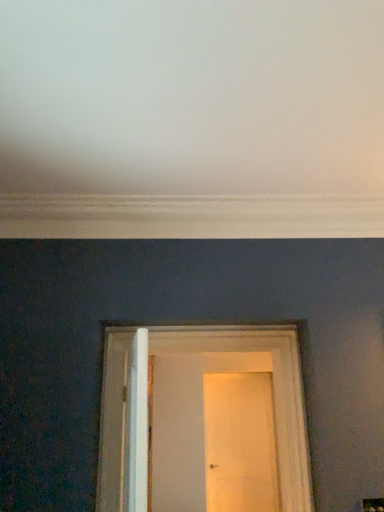
This screenshot has width=384, height=512. What do you see at coordinates (213, 367) in the screenshot?
I see `white wooden door at center, placed as the 1th door when sorted from front to back` at bounding box center [213, 367].

Where is `white wooden door at center, acting as the first door starting from the top`? white wooden door at center, acting as the first door starting from the top is located at coordinates (213, 367).

Based on the photo, measure the distance between white wooden door at center, marked as the second door in a bottom-to-top arrangement, and camera.

The depth of white wooden door at center, marked as the second door in a bottom-to-top arrangement, is 1.41 meters.

The width and height of the screenshot is (384, 512). Describe the element at coordinates (240, 443) in the screenshot. I see `wooden door at center, which is the second door in top-to-bottom order` at that location.

You are a GUI agent. You are given a task and a screenshot of the screen. Output one action in this format:
    pyautogui.click(x=<x>, y=<y>)
    Task: Click on the wooden door at center, the second door in the front-to-back sequence
    The image size is (384, 512).
    Given the screenshot: What is the action you would take?
    [x=240, y=443]

Measure the distance between point (261, 481) and camera.

The distance of point (261, 481) from camera is 5.39 meters.

Image resolution: width=384 pixels, height=512 pixels. I want to click on white wooden door at center, marked as the second door in a back-to-front arrangement, so click(x=213, y=367).

Between wooden door at center, which is the second door in top-to-bottom order, and white wooden door at center, acting as the first door starting from the top, which one appears on the left side from the viewer's perspective?

Positioned to the left is white wooden door at center, acting as the first door starting from the top.

In the image, is wooden door at center, the second door in the front-to-back sequence, positioned in front of or behind white wooden door at center, marked as the second door in a back-to-front arrangement?

Visually, wooden door at center, the second door in the front-to-back sequence, is located behind white wooden door at center, marked as the second door in a back-to-front arrangement.

Does point (249, 403) appear closer or farther from the camera than point (114, 478)?

Point (249, 403).

From the image's perspective, is wooden door at center, the second door in the front-to-back sequence, above or below white wooden door at center, acting as the first door starting from the top?

wooden door at center, the second door in the front-to-back sequence, is below white wooden door at center, acting as the first door starting from the top.

From a real-world perspective, is wooden door at center, arranged as the first door when ordered from the bottom, on white wooden door at center, placed as the 1th door when sorted from front to back?

No, from a real-world perspective, wooden door at center, arranged as the first door when ordered from the bottom, is not above white wooden door at center, placed as the 1th door when sorted from front to back.

Between wooden door at center, placed as the 1th door when sorted from back to front, and white wooden door at center, acting as the first door starting from the top, which one has larger width?

Wider between the two is white wooden door at center, acting as the first door starting from the top.

Considering the relative sizes of wooden door at center, arranged as the first door when ordered from the bottom, and white wooden door at center, marked as the second door in a bottom-to-top arrangement, in the image provided, is wooden door at center, arranged as the first door when ordered from the bottom, shorter than white wooden door at center, marked as the second door in a bottom-to-top arrangement,?

No.

Can you confirm if wooden door at center, which is the second door in top-to-bottom order, is bigger than white wooden door at center, placed as the 1th door when sorted from front to back?

No.

Is white wooden door at center, placed as the 1th door when sorted from front to back, inside wooden door at center, placed as the 1th door when sorted from back to front?

No, white wooden door at center, placed as the 1th door when sorted from front to back, is not surrounded by wooden door at center, placed as the 1th door when sorted from back to front.

Are wooden door at center, which is the second door in top-to-bottom order, and white wooden door at center, marked as the second door in a bottom-to-top arrangement, far apart?

Yes, wooden door at center, which is the second door in top-to-bottom order, is far from white wooden door at center, marked as the second door in a bottom-to-top arrangement.

Could you tell me if wooden door at center, arranged as the first door when ordered from the bottom, is facing white wooden door at center, marked as the second door in a back-to-front arrangement?

Yes, wooden door at center, arranged as the first door when ordered from the bottom, is aimed at white wooden door at center, marked as the second door in a back-to-front arrangement.

Where is `door lying behind the white wooden door at center, marked as the second door in a back-to-front arrangement`? The width and height of the screenshot is (384, 512). door lying behind the white wooden door at center, marked as the second door in a back-to-front arrangement is located at coordinates (240, 443).

Considering the relative positions of white wooden door at center, placed as the 1th door when sorted from front to back, and wooden door at center, the second door in the front-to-back sequence, in the image provided, is white wooden door at center, placed as the 1th door when sorted from front to back, to the left of wooden door at center, the second door in the front-to-back sequence, from the viewer's perspective?

Indeed, white wooden door at center, placed as the 1th door when sorted from front to back, is positioned on the left side of wooden door at center, the second door in the front-to-back sequence.

Between white wooden door at center, marked as the second door in a bottom-to-top arrangement, and wooden door at center, arranged as the first door when ordered from the bottom, which one is positioned in front?

white wooden door at center, marked as the second door in a bottom-to-top arrangement.

Which is closer to the camera, (285, 358) or (273, 443)?

Point (285, 358) appears to be closer to the viewer than point (273, 443).

From the image's perspective, between white wooden door at center, marked as the second door in a bottom-to-top arrangement, and wooden door at center, which is the second door in top-to-bottom order, which one is located above?

white wooden door at center, marked as the second door in a bottom-to-top arrangement.

From a real-world perspective, who is located lower, white wooden door at center, placed as the 1th door when sorted from front to back, or wooden door at center, the second door in the front-to-back sequence?

From a 3D spatial view, wooden door at center, the second door in the front-to-back sequence, is below.

From the picture: Considering the relative sizes of white wooden door at center, marked as the second door in a bottom-to-top arrangement, and wooden door at center, the second door in the front-to-back sequence, in the image provided, is white wooden door at center, marked as the second door in a bottom-to-top arrangement, thinner than wooden door at center, the second door in the front-to-back sequence,?

Incorrect, the width of white wooden door at center, marked as the second door in a bottom-to-top arrangement, is not less than that of wooden door at center, the second door in the front-to-back sequence.

In terms of height, does white wooden door at center, acting as the first door starting from the top, look taller or shorter compared to wooden door at center, arranged as the first door when ordered from the bottom?

white wooden door at center, acting as the first door starting from the top, is shorter than wooden door at center, arranged as the first door when ordered from the bottom.

Is white wooden door at center, marked as the second door in a back-to-front arrangement, bigger than wooden door at center, which is the second door in top-to-bottom order?

Correct, white wooden door at center, marked as the second door in a back-to-front arrangement, is larger in size than wooden door at center, which is the second door in top-to-bottom order.

Is white wooden door at center, placed as the 1th door when sorted from front to back, inside the boundaries of wooden door at center, placed as the 1th door when sorted from back to front, or outside?

white wooden door at center, placed as the 1th door when sorted from front to back, cannot be found inside wooden door at center, placed as the 1th door when sorted from back to front.

Consider the image. Is white wooden door at center, acting as the first door starting from the top, in contact with wooden door at center, the second door in the front-to-back sequence?

white wooden door at center, acting as the first door starting from the top, and wooden door at center, the second door in the front-to-back sequence, are not in contact.

Is wooden door at center, the second door in the front-to-back sequence, at the back of white wooden door at center, marked as the second door in a bottom-to-top arrangement?

Yes.

Locate an element on the screen. door below the white wooden door at center, marked as the second door in a back-to-front arrangement (from a real-world perspective) is located at coordinates (240, 443).

Image resolution: width=384 pixels, height=512 pixels. In order to click on door located on the right of white wooden door at center, placed as the 1th door when sorted from front to back in this screenshot , I will do `click(240, 443)`.

The height and width of the screenshot is (512, 384). In order to click on door above the wooden door at center, arranged as the first door when ordered from the bottom (from a real-world perspective) in this screenshot , I will do `click(213, 367)`.